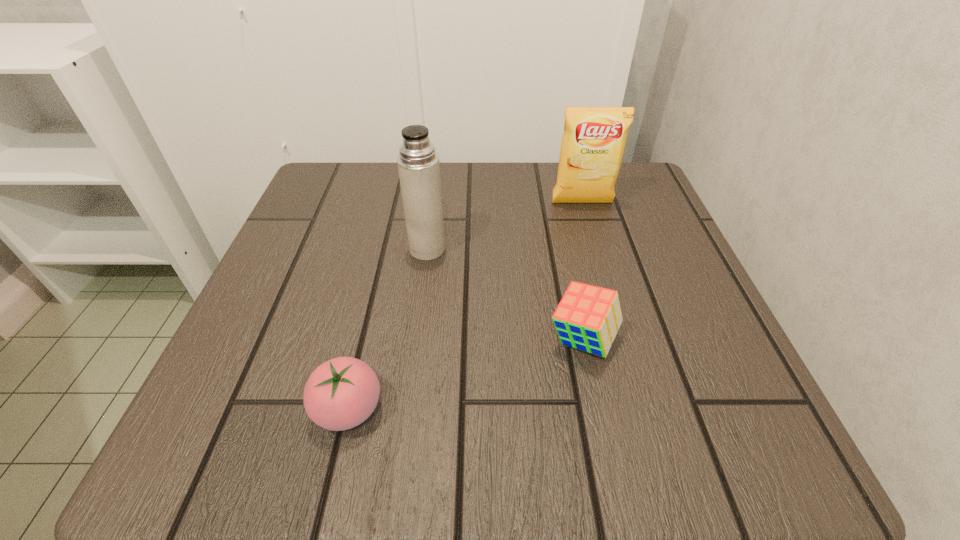
I want to click on object located at the left edge, so click(x=341, y=393).

Locate an element on the screen. This screenshot has height=540, width=960. crisp (potato chip) positioned at the right edge is located at coordinates (593, 143).

Identify the location of cube situated at the right edge. The image size is (960, 540). (588, 317).

Locate an element on the screen. object that is at the near left corner is located at coordinates (341, 393).

Where is `object located in the far right corner section of the desktop`? This screenshot has width=960, height=540. object located in the far right corner section of the desktop is located at coordinates (593, 143).

Identify the location of free space at the far edge of the desktop. (513, 224).

In the image, there is a desktop. Where is `free space at the near edge`? The height and width of the screenshot is (540, 960). free space at the near edge is located at coordinates (462, 426).

The width and height of the screenshot is (960, 540). Find the location of `free region at the left edge of the desktop`. free region at the left edge of the desktop is located at coordinates (242, 361).

Where is `vacant region at the right edge of the desktop`? The height and width of the screenshot is (540, 960). vacant region at the right edge of the desktop is located at coordinates (636, 239).

The image size is (960, 540). I want to click on vacant space at the far left corner, so click(343, 194).